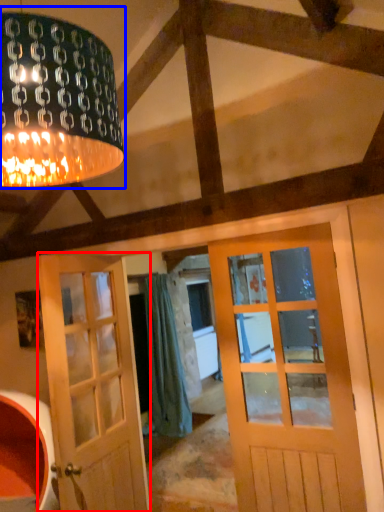
Question: Which point is further to the camera, door (highlighted by a red box) or lamp (highlighted by a blue box)?

Choices:
 (A) door
 (B) lamp

Answer: (A)